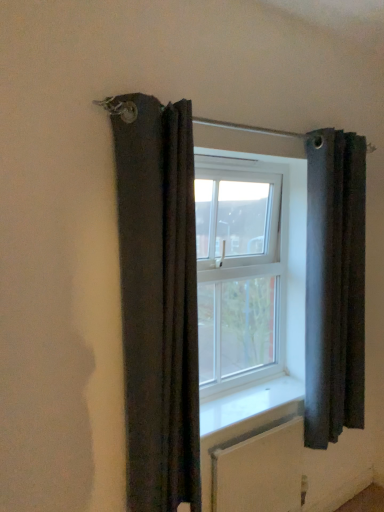
Image resolution: width=384 pixels, height=512 pixels. Describe the element at coordinates (158, 300) in the screenshot. I see `dark fabric curtain at left, placed as the 2th curtain when sorted from right to left` at that location.

What do you see at coordinates (248, 268) in the screenshot?
I see `clear glass window at center` at bounding box center [248, 268].

The width and height of the screenshot is (384, 512). In order to click on dark fabric curtain at left, which is the 1th curtain in left-to-right order in this screenshot , I will do `click(158, 300)`.

From the image's perspective, is dark fabric curtain at left, which is the 1th curtain in left-to-right order, below dark gray fabric curtain at right, which is the second curtain in front-to-back order?

Correct, dark fabric curtain at left, which is the 1th curtain in left-to-right order, appears lower than dark gray fabric curtain at right, which is the second curtain in front-to-back order, in the image.

Is dark fabric curtain at left, which is the 1th curtain in left-to-right order, looking in the opposite direction of dark gray fabric curtain at right, acting as the 1th curtain starting from the right?

→ No, dark gray fabric curtain at right, acting as the 1th curtain starting from the right, is not at the back of dark fabric curtain at left, which is the 1th curtain in left-to-right order.

Looking at this image, is dark fabric curtain at left, which is counted as the 2th curtain, starting from the back, far from dark gray fabric curtain at right, which is the second curtain in front-to-back order?

dark fabric curtain at left, which is counted as the 2th curtain, starting from the back, is near dark gray fabric curtain at right, which is the second curtain in front-to-back order, not far away.

From the image's perspective, which object appears higher, white textured radiator at lower center or clear glass window at center?

clear glass window at center is shown above in the image.

Could you tell me if white textured radiator at lower center is facing clear glass window at center?

No, white textured radiator at lower center does not turn towards clear glass window at center.

Can you confirm if white textured radiator at lower center is positioned to the left of clear glass window at center?

No, white textured radiator at lower center is not to the left of clear glass window at center.

Between white smooth window sill at center and clear glass window at center, which one appears on the left side from the viewer's perspective?

Positioned to the left is clear glass window at center.

From the image's perspective, is white smooth window sill at center below clear glass window at center?

Correct, white smooth window sill at center appears lower than clear glass window at center in the image.

Is clear glass window at center completely or partially inside white smooth window sill at center?

Definitely not — clear glass window at center is not inside white smooth window sill at center.

Looking at their sizes, would you say white smooth window sill at center is wider or thinner than dark gray fabric curtain at right, acting as the 1th curtain starting from the right?

Considering their sizes, white smooth window sill at center looks broader than dark gray fabric curtain at right, acting as the 1th curtain starting from the right.

Can you confirm if white smooth window sill at center is shorter than dark gray fabric curtain at right, the 2th curtain in the left-to-right sequence?

Indeed, white smooth window sill at center has a lesser height compared to dark gray fabric curtain at right, the 2th curtain in the left-to-right sequence.

How different are the orientations of white smooth window sill at center and dark gray fabric curtain at right, acting as the 1th curtain starting from the right, in degrees?

0.000472 degrees separate the facing orientations of white smooth window sill at center and dark gray fabric curtain at right, acting as the 1th curtain starting from the right.

Locate an element on the screen. window sill located below the dark gray fabric curtain at right, acting as the 1th curtain starting from the right (from the image's perspective) is located at coordinates (248, 403).

What's the angular difference between white smooth window sill at center and dark fabric curtain at left, placed as the 2th curtain when sorted from right to left,'s facing directions?

The angular difference between white smooth window sill at center and dark fabric curtain at left, placed as the 2th curtain when sorted from right to left, is 0.000589 degrees.

From a real-world perspective, between white smooth window sill at center and dark fabric curtain at left, which is the 1th curtain in left-to-right order, who is vertically higher?

In real-world perspective, dark fabric curtain at left, which is the 1th curtain in left-to-right order, is above.

Which of these two, white smooth window sill at center or dark fabric curtain at left, which is counted as the 2th curtain, starting from the back, is wider?

white smooth window sill at center is wider.

From the image's perspective, count 1st curtains upward from the white smooth window sill at center and point to it. Please provide its 2D coordinates.

[(158, 300)]

Is dark fabric curtain at left, which is the 1th curtain in left-to-right order, turned away from white smooth window sill at center?

No.

Which object is closer to the camera, dark fabric curtain at left, acting as the first curtain starting from the front, or white smooth window sill at center?

dark fabric curtain at left, acting as the first curtain starting from the front.

Considering the relative positions of clear glass window at center and dark gray fabric curtain at right, the 2th curtain in the left-to-right sequence, in the image provided, is clear glass window at center behind dark gray fabric curtain at right, the 2th curtain in the left-to-right sequence,?

That is True.

Is clear glass window at center taller or shorter than dark gray fabric curtain at right, the 1th curtain when ordered from back to front?

Clearly, clear glass window at center is shorter compared to dark gray fabric curtain at right, the 1th curtain when ordered from back to front.

Is point (234, 402) positioned before point (352, 365)?

That is True.

Which object is positioned more to the right, clear glass window at center or dark gray fabric curtain at right, the 1th curtain when ordered from back to front?

dark gray fabric curtain at right, the 1th curtain when ordered from back to front, is more to the right.

In order to click on curtain beneath the dark fabric curtain at left, which is the 1th curtain in left-to-right order (from a real-world perspective) in this screenshot , I will do `click(334, 285)`.

The height and width of the screenshot is (512, 384). I want to click on radiator on the right of clear glass window at center, so click(x=259, y=469).

Looking at the image, which one is located further to dark fabric curtain at left, placed as the 2th curtain when sorted from right to left, clear glass window at center or white textured radiator at lower center?

clear glass window at center.

Which object lies nearer to the anchor point dark gray fabric curtain at right, which is the second curtain in front-to-back order, clear glass window at center or dark fabric curtain at left, placed as the 2th curtain when sorted from right to left?

clear glass window at center lies closer to dark gray fabric curtain at right, which is the second curtain in front-to-back order, than the other object.

When comparing their distances from clear glass window at center, does dark gray fabric curtain at right, acting as the 1th curtain starting from the right, or dark fabric curtain at left, which is the 1th curtain in left-to-right order, seem further?

dark fabric curtain at left, which is the 1th curtain in left-to-right order, is further to clear glass window at center.

Considering their positions, is white smooth window sill at center positioned closer to white textured radiator at lower center than clear glass window at center?

white smooth window sill at center is positioned closer to the anchor white textured radiator at lower center.

Estimate the real-world distances between objects in this image. Which object is further from dark fabric curtain at left, which is counted as the 2th curtain, starting from the back, clear glass window at center or white smooth window sill at center?

Based on the image, clear glass window at center appears to be further to dark fabric curtain at left, which is counted as the 2th curtain, starting from the back.

Looking at the image, which one is located further to dark fabric curtain at left, which is the 1th curtain in left-to-right order, dark gray fabric curtain at right, the 1th curtain when ordered from back to front, or clear glass window at center?

dark gray fabric curtain at right, the 1th curtain when ordered from back to front.

Based on their spatial positions, is clear glass window at center or dark gray fabric curtain at right, which is the second curtain in front-to-back order, further from dark fabric curtain at left, acting as the first curtain starting from the front?

Among the two, dark gray fabric curtain at right, which is the second curtain in front-to-back order, is located further to dark fabric curtain at left, acting as the first curtain starting from the front.

Based on the photo, which object lies nearer to the anchor point white smooth window sill at center, dark gray fabric curtain at right, the 2th curtain in the left-to-right sequence, or white textured radiator at lower center?

white textured radiator at lower center.

This screenshot has width=384, height=512. What are the coordinates of `window situated between dark fabric curtain at left, acting as the first curtain starting from the front, and dark gray fabric curtain at right, which is the second curtain in front-to-back order, from left to right` in the screenshot? It's located at (248, 268).

Locate an element on the screen. The width and height of the screenshot is (384, 512). window sill that lies between dark gray fabric curtain at right, which is the second curtain in front-to-back order, and white textured radiator at lower center from top to bottom is located at coordinates (248, 403).

Locate an element on the screen. The height and width of the screenshot is (512, 384). window sill that lies between dark fabric curtain at left, acting as the first curtain starting from the front, and white textured radiator at lower center from top to bottom is located at coordinates (248, 403).

Locate an element on the screen. This screenshot has height=512, width=384. curtain that lies between dark gray fabric curtain at right, the 2th curtain in the left-to-right sequence, and white textured radiator at lower center from top to bottom is located at coordinates (158, 300).